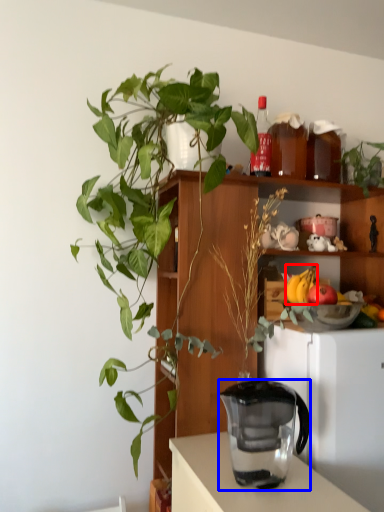
Question: Which point is further to the camera, banana (highlighted by a red box) or jug (highlighted by a blue box)?

Choices:
 (A) banana
 (B) jug

Answer: (A)